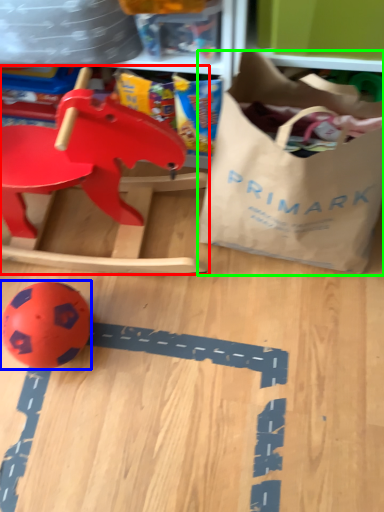
Question: Estimate the real-world distances between objects in this image. Which object is closer to toy (highlighted by a red box), toy (highlighted by a blue box) or grocery bag (highlighted by a green box)?

Choices:
 (A) toy
 (B) grocery bag

Answer: (B)